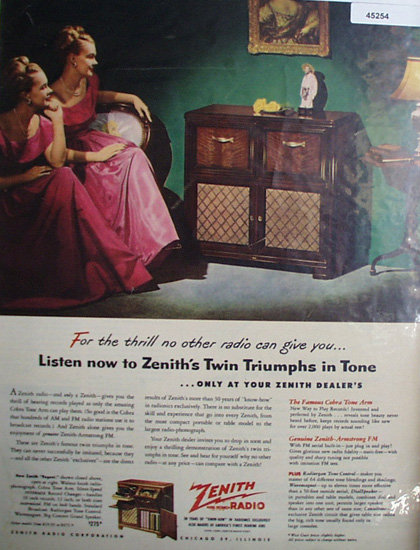
The width and height of the screenshot is (420, 550). In order to click on floor in this screenshot , I will do `click(249, 291)`.